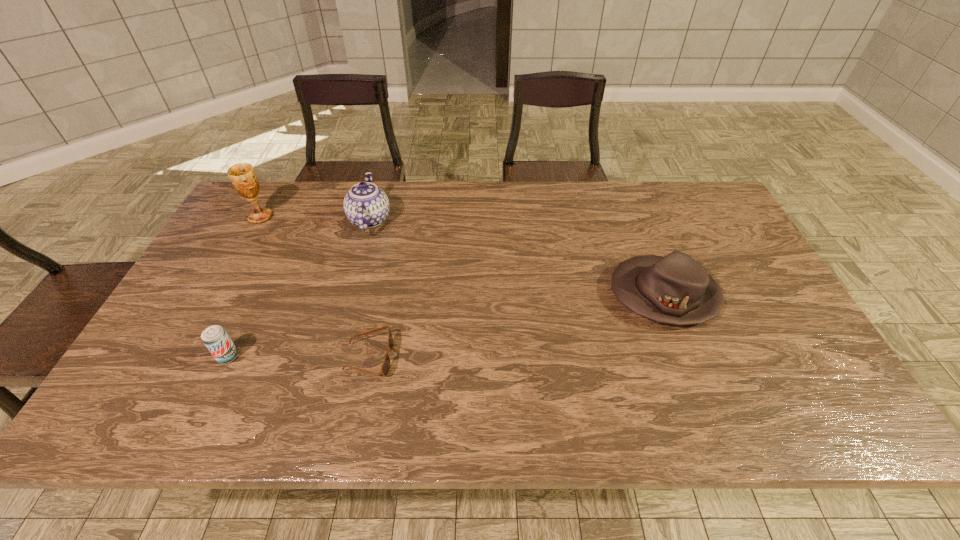
Locate an element on the screen. The image size is (960, 540). vacant region located 0.230m on the decorative side of the third nearest object is located at coordinates (523, 295).

Find the location of a particular element. This screenshot has height=540, width=960. free spot located 0.090m on the decorative side of the third nearest object is located at coordinates (575, 295).

The width and height of the screenshot is (960, 540). Find the location of `vacant space situated 0.260m on the right of the beer can`. vacant space situated 0.260m on the right of the beer can is located at coordinates (348, 356).

What are the coordinates of `free region located on the frames of the shortest object` in the screenshot? It's located at (477, 358).

Locate an element on the screen. Image resolution: width=960 pixels, height=540 pixels. chalice that is positioned at the far edge is located at coordinates (243, 177).

Where is `chinaware at the far edge`? The width and height of the screenshot is (960, 540). chinaware at the far edge is located at coordinates (366, 205).

The image size is (960, 540). I want to click on object present at the left edge, so pyautogui.click(x=243, y=177).

The image size is (960, 540). I want to click on object located at the right edge, so click(675, 289).

Where is `object that is at the far left corner`? The width and height of the screenshot is (960, 540). object that is at the far left corner is located at coordinates (243, 177).

This screenshot has height=540, width=960. Find the location of `free location at the far edge of the desktop`. free location at the far edge of the desktop is located at coordinates (638, 193).